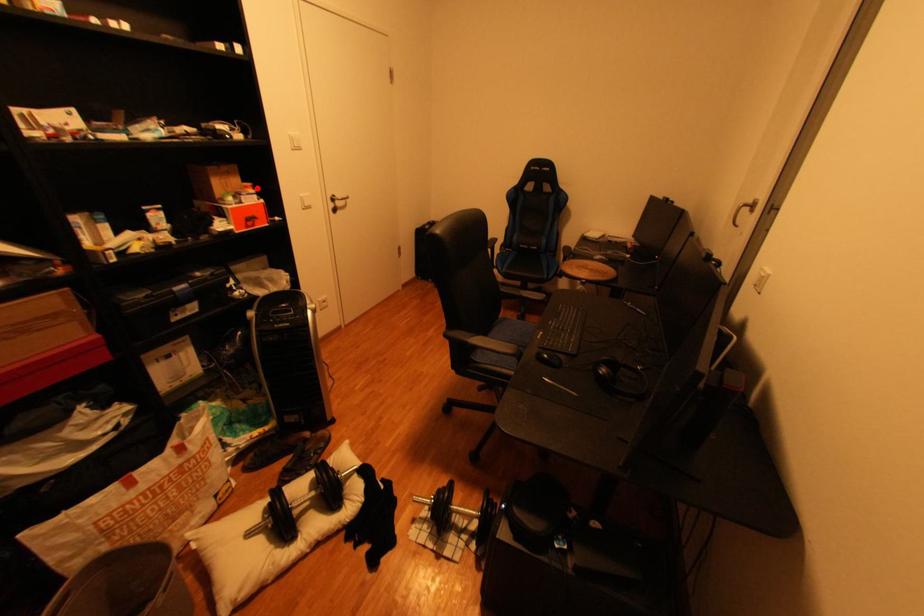
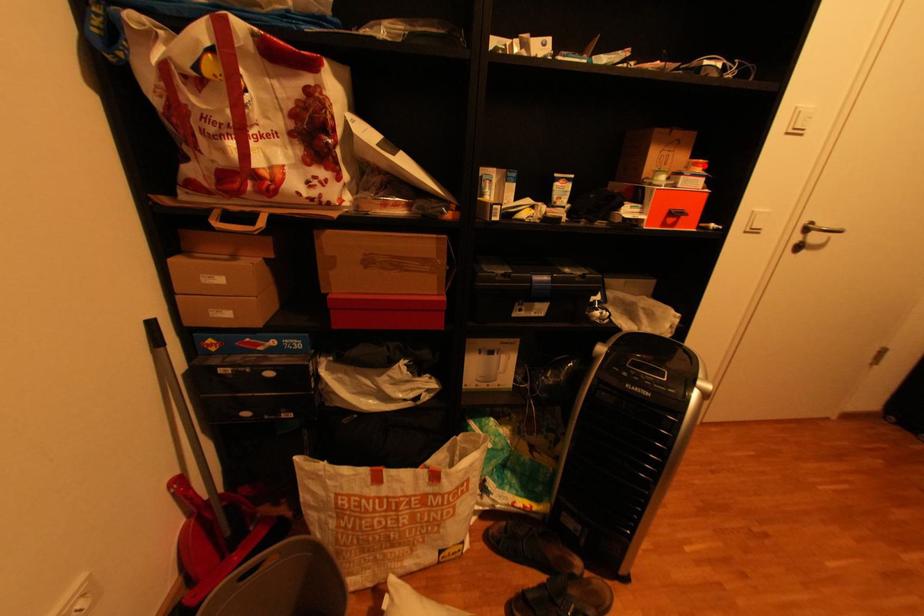
I am providing you with two images of the same scene from different viewpoints. A red point is marked on the first image and another point is marked on the second image. Do the highlighted points in image1 and image2 indicate the same real-world spot?

Yes